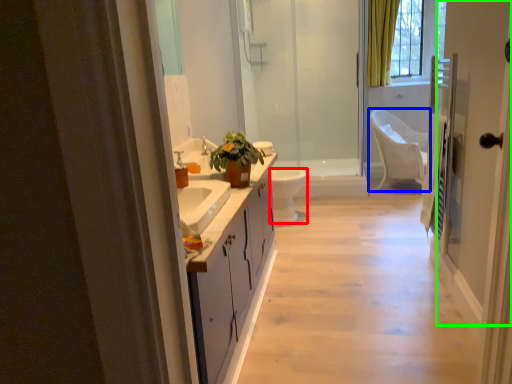
Question: Which object is positioned closest to toilet (highlighted by a red box)? Select from chair (highlighted by a blue box) and screen door (highlighted by a green box).

Choices:
 (A) chair
 (B) screen door

Answer: (A)